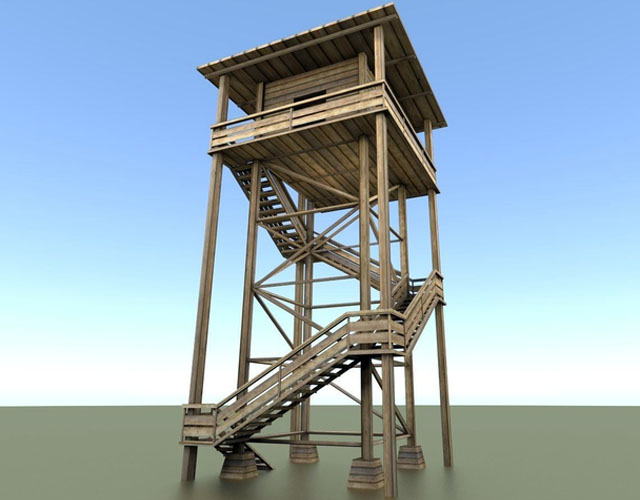
Image resolution: width=640 pixels, height=500 pixels. What are the coordinates of `landings` in the screenshot? It's located at (198, 428), (356, 357), (445, 293), (310, 253).